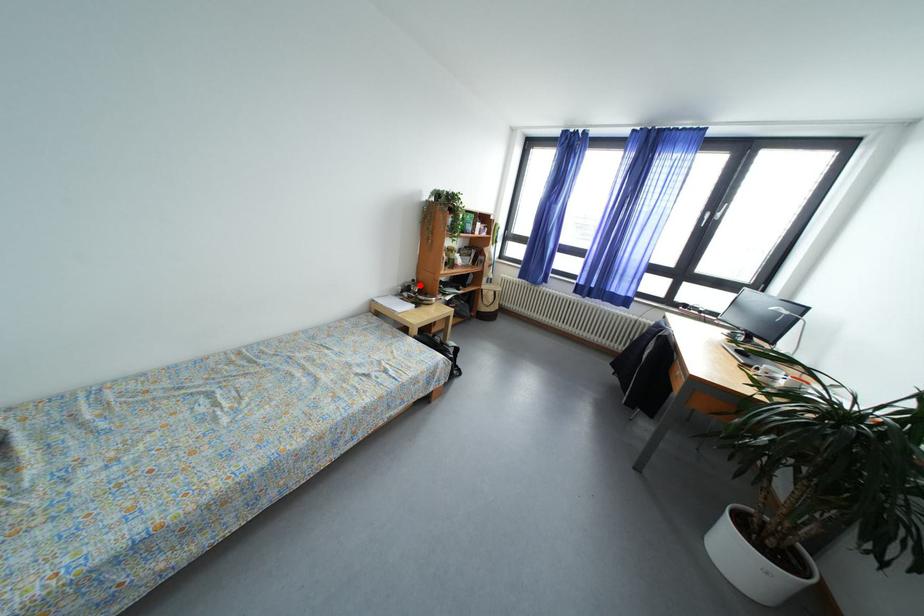
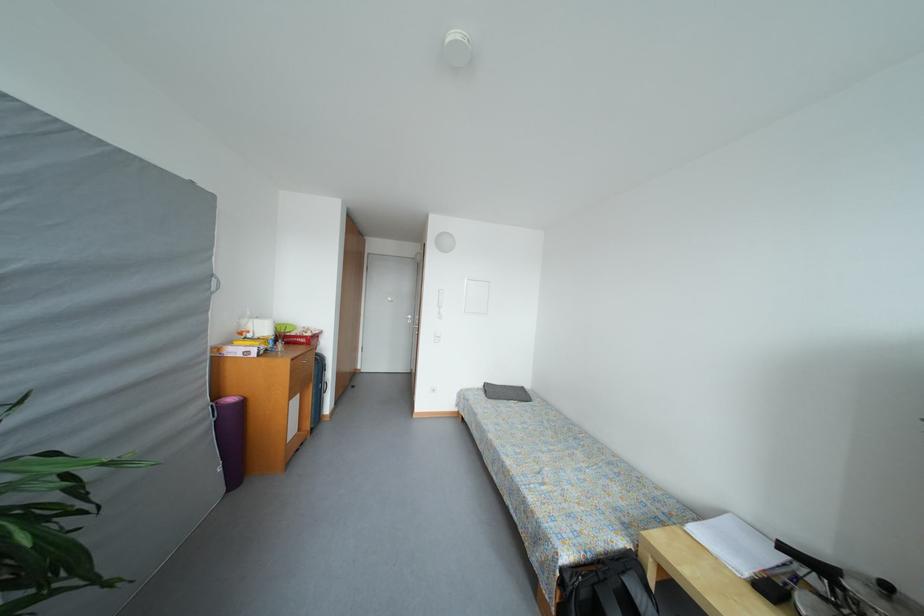
The point at the highlighted location is marked in the first image. Where is the corresponding point in the second image?

(893, 591)